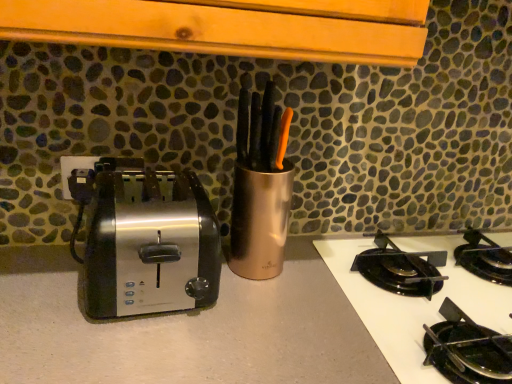
Question: Can you confirm if satin metallic toaster at left is thinner than black glass cooktop at lower right?

Choices:
 (A) no
 (B) yes

Answer: (B)

Question: From the image's perspective, does satin metallic toaster at left appear higher than black glass cooktop at lower right?

Choices:
 (A) yes
 (B) no

Answer: (A)

Question: Considering the relative positions of satin metallic toaster at left and black glass cooktop at lower right in the image provided, is satin metallic toaster at left behind black glass cooktop at lower right?

Choices:
 (A) yes
 (B) no

Answer: (A)

Question: Considering the relative positions of satin metallic toaster at left and black glass cooktop at lower right in the image provided, is satin metallic toaster at left to the right of black glass cooktop at lower right from the viewer's perspective?

Choices:
 (A) no
 (B) yes

Answer: (A)

Question: Does satin metallic toaster at left have a greater width compared to black glass cooktop at lower right?

Choices:
 (A) yes
 (B) no

Answer: (B)

Question: Is satin metallic toaster at left positioned before black glass cooktop at lower right?

Choices:
 (A) yes
 (B) no

Answer: (B)

Question: Is satin finish countertop at center located outside satin metallic toaster at left?

Choices:
 (A) yes
 (B) no

Answer: (A)

Question: Is satin finish countertop at center far from satin metallic toaster at left?

Choices:
 (A) no
 (B) yes

Answer: (A)

Question: Can you confirm if satin finish countertop at center is positioned to the left of satin metallic toaster at left?

Choices:
 (A) no
 (B) yes

Answer: (A)

Question: From the image's perspective, is satin finish countertop at center below satin metallic toaster at left?

Choices:
 (A) yes
 (B) no

Answer: (A)

Question: Considering the relative sizes of satin finish countertop at center and satin metallic toaster at left in the image provided, is satin finish countertop at center taller than satin metallic toaster at left?

Choices:
 (A) no
 (B) yes

Answer: (B)

Question: Considering the relative sizes of satin finish countertop at center and satin metallic toaster at left in the image provided, is satin finish countertop at center wider than satin metallic toaster at left?

Choices:
 (A) yes
 (B) no

Answer: (A)

Question: Is black glass cooktop at lower right completely or partially outside of satin metallic toaster at left?

Choices:
 (A) yes
 (B) no

Answer: (A)